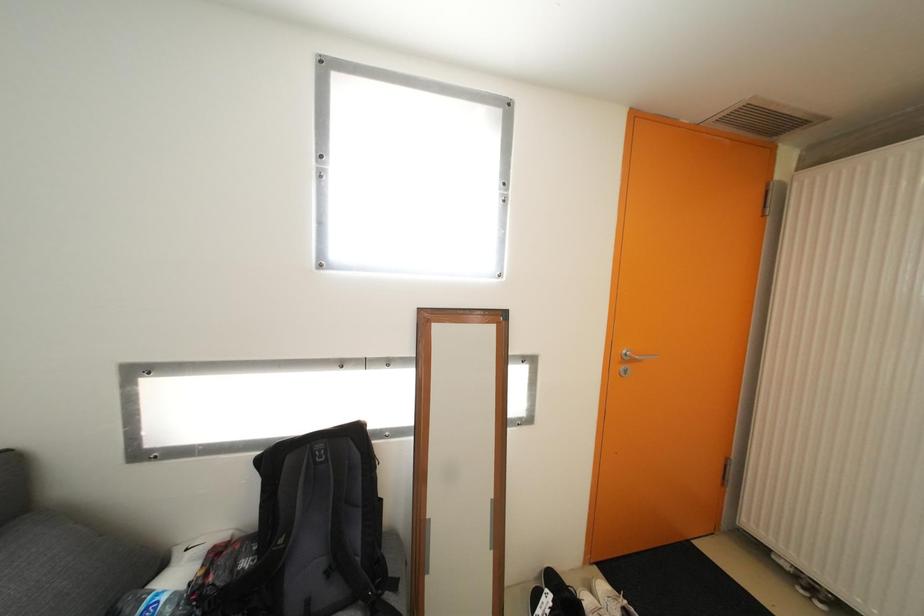
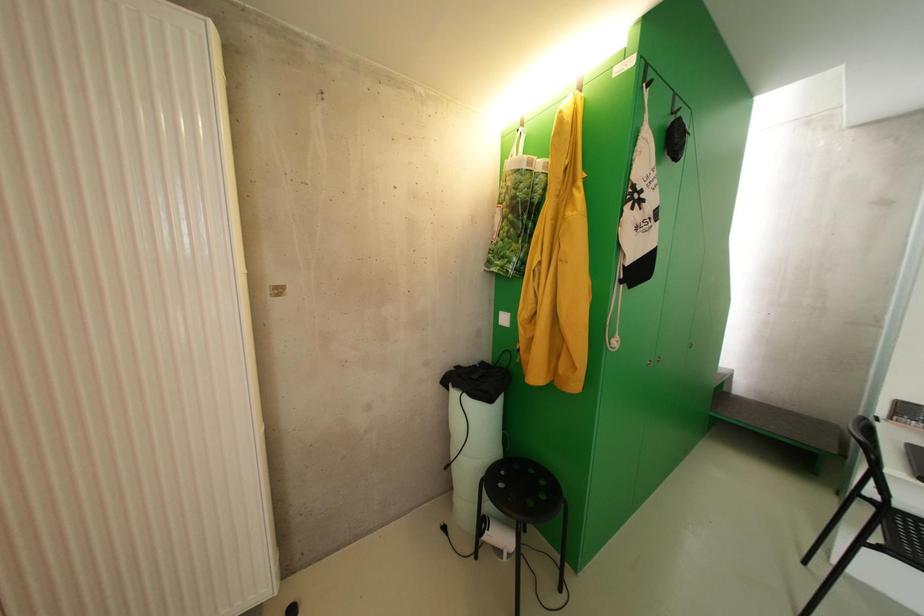
Question: The camera is either moving clockwise (left) or counter-clockwise (right) around the object. The first image is from the beginning of the video and the second image is from the end. Is the camera moving left or right when shooting the video?

Choices:
 (A) Left
 (B) Right

Answer: (A)